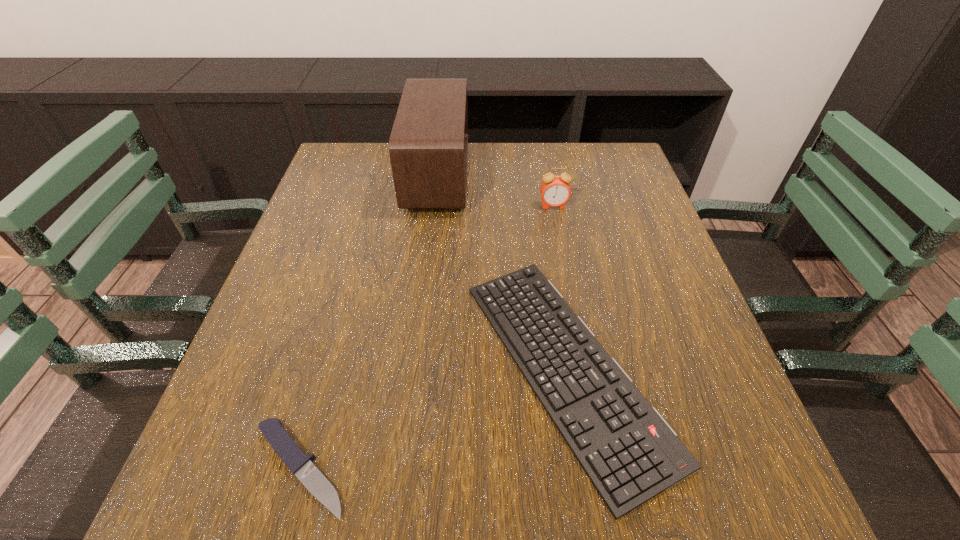
You are a GUI agent. You are given a task and a screenshot of the screen. Output one action in this format:
    pyautogui.click(x=<x>, y=<y>)
    Task: Click on the tallest object
    The width and height of the screenshot is (960, 540).
    Given the screenshot: What is the action you would take?
    pyautogui.click(x=428, y=146)

Image resolution: width=960 pixels, height=540 pixels. What are the coordinates of `alarm clock` in the screenshot? It's located at (555, 191).

Locate an element on the screen. Image resolution: width=960 pixels, height=540 pixels. computer keyboard is located at coordinates (629, 452).

Locate an element on the screen. The height and width of the screenshot is (540, 960). the shortest object is located at coordinates (301, 465).

This screenshot has width=960, height=540. I want to click on vacant area situated 0.220m on the front-facing side of the tallest object, so click(x=549, y=176).

Locate an element on the screen. The height and width of the screenshot is (540, 960). vacant space located 0.210m on the face of the second tallest object is located at coordinates coord(565,270).

Locate an element on the screen. blank space located 0.150m on the left of the second shortest object is located at coordinates point(382,367).

Locate an element on the screen. vacant space located on the back of the steak knife is located at coordinates (347, 300).

Find the location of `object that is at the far edge`. object that is at the far edge is located at coordinates (428, 146).

The height and width of the screenshot is (540, 960). What are the coordinates of `computer keyboard present at the near edge` in the screenshot? It's located at (629, 452).